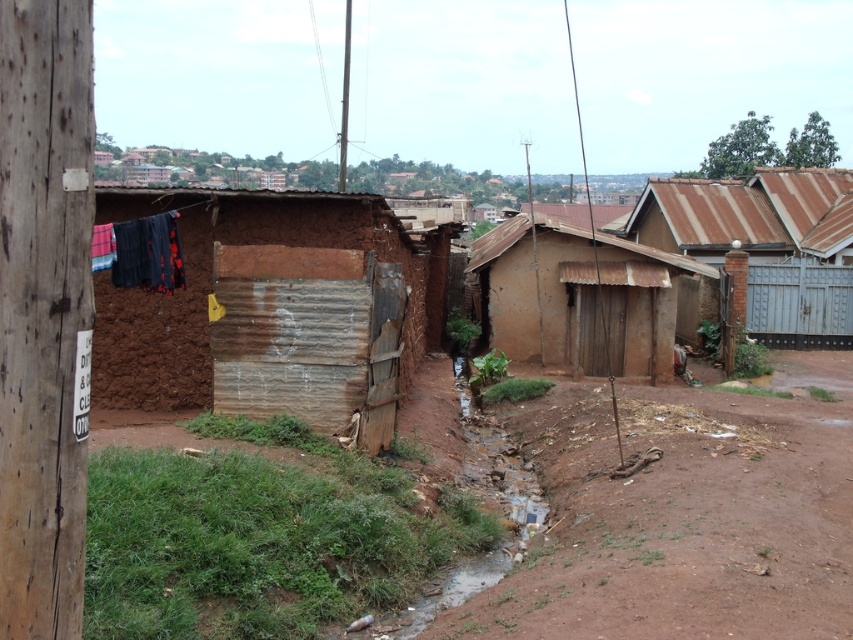
Question: Which of the following is the farthest from the observer?

Choices:
 (A) (345, 42)
 (B) (850, 234)
 (C) (589, 296)
 (D) (225, 387)

Answer: (A)

Question: Is brown corrugated metal hut at center to the right of brushed metal telegraph pole at upper center from the viewer's perspective?

Choices:
 (A) yes
 (B) no

Answer: (A)

Question: Among these objects, which one is farthest from the camera?

Choices:
 (A) brown corrugated roof at upper right
 (B) brown corrugated metal hut at center
 (C) brown dirt field at center

Answer: (A)

Question: Which point is closer to the camera taking this photo?

Choices:
 (A) (347, 84)
 (B) (107, 237)
 (C) (607, 573)
 (D) (578, 252)

Answer: (C)

Question: Does brown dirt field at center lie in front of brushed metal telegraph pole at upper center?

Choices:
 (A) no
 (B) yes

Answer: (B)

Question: In this image, where is plaid fabric at left located relative to brushed metal telegraph pole at upper center?

Choices:
 (A) left
 (B) right

Answer: (B)